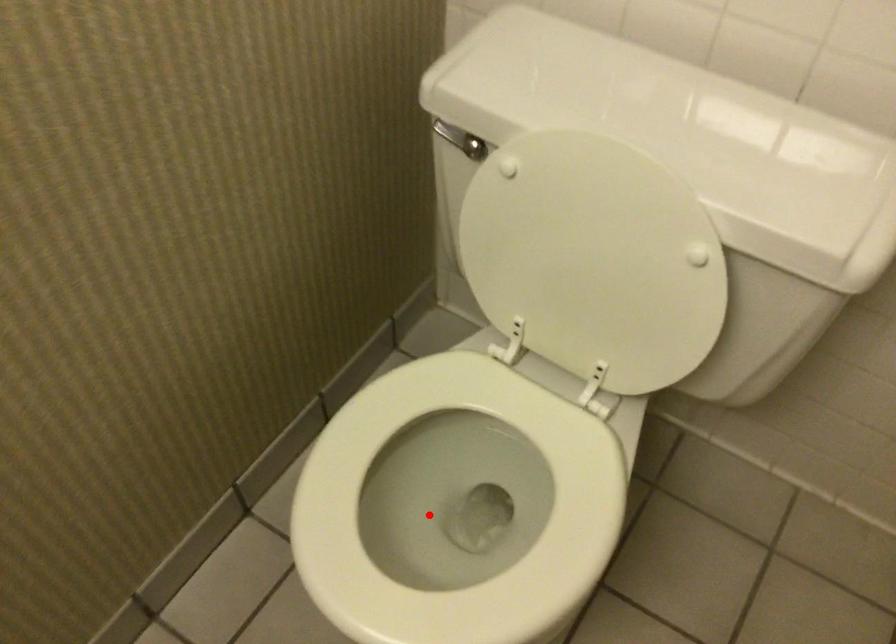
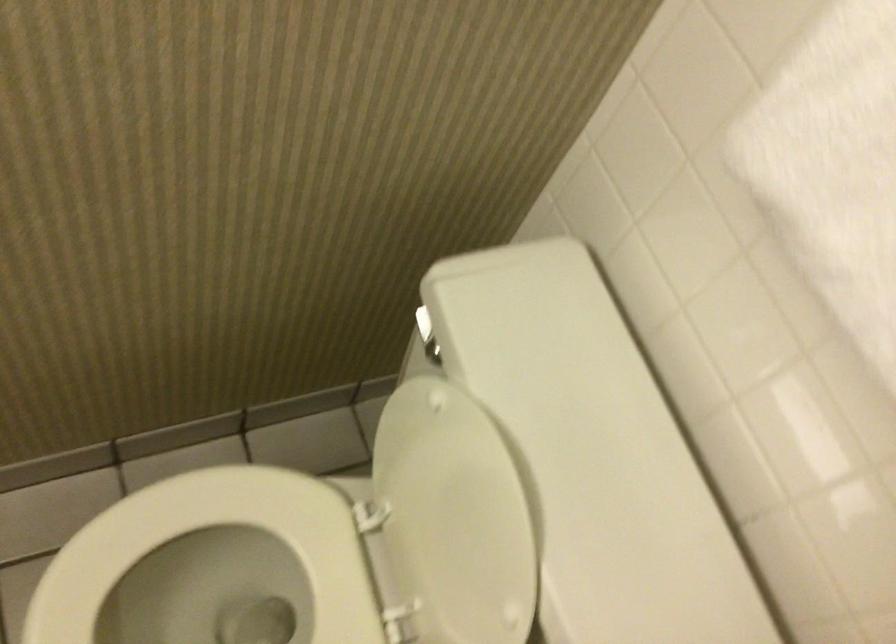
Find the pixel in the second image that matches the highlighted location in the first image.

(222, 590)